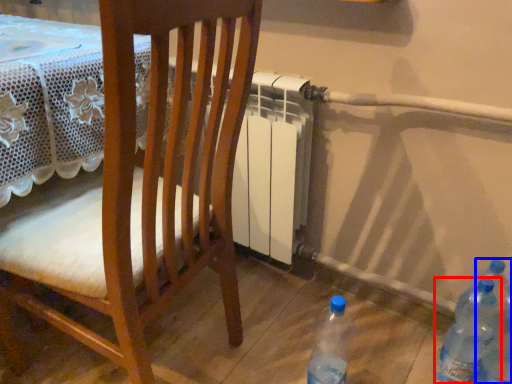
Question: Which object appears farthest to the camera in this image, bottle (highlighted by a red box) or bottle (highlighted by a blue box)?

Choices:
 (A) bottle
 (B) bottle

Answer: (A)